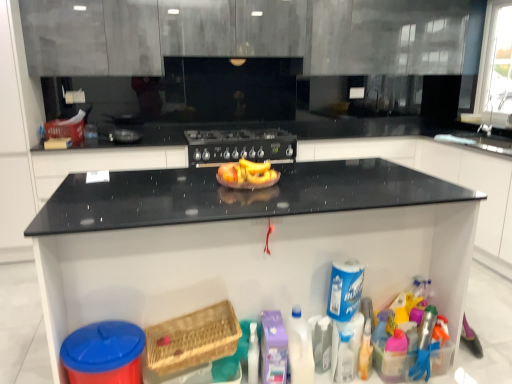
Question: Are translucent plastic toy at lower right and black granite countertop at center making contact?

Choices:
 (A) yes
 (B) no

Answer: (B)

Question: Is translucent plastic toy at lower right shorter than black granite countertop at center?

Choices:
 (A) yes
 (B) no

Answer: (A)

Question: Considering the relative sizes of translucent plastic toy at lower right and black granite countertop at center in the image provided, is translucent plastic toy at lower right taller than black granite countertop at center?

Choices:
 (A) no
 (B) yes

Answer: (A)

Question: Does translucent plastic toy at lower right appear on the right side of black granite countertop at center?

Choices:
 (A) yes
 (B) no

Answer: (A)

Question: Is translucent plastic toy at lower right bigger than black granite countertop at center?

Choices:
 (A) yes
 (B) no

Answer: (B)

Question: Relative to woven wood basket at lower center, is metallic silver toaster at center, which is the 2th appliance in right-to-left order, in front or behind?

Choices:
 (A) behind
 (B) front

Answer: (A)

Question: Considering the positions of metallic silver toaster at center, positioned as the first appliance in left-to-right order, and woven wood basket at lower center in the image, is metallic silver toaster at center, positioned as the first appliance in left-to-right order, taller or shorter than woven wood basket at lower center?

Choices:
 (A) tall
 (B) short

Answer: (B)

Question: From the image's perspective, is metallic silver toaster at center, which is the 2th appliance in right-to-left order, located above or below woven wood basket at lower center?

Choices:
 (A) above
 (B) below

Answer: (A)

Question: Is metallic silver toaster at center, positioned as the first appliance in left-to-right order, to the left or to the right of woven wood basket at lower center in the image?

Choices:
 (A) right
 (B) left

Answer: (B)

Question: In terms of size, does white plastic bottle at lower right appear bigger or smaller than matte gray cabinets at upper center, the 1th cabinetry from the left?

Choices:
 (A) big
 (B) small

Answer: (B)

Question: Is white plastic bottle at lower right inside or outside of matte gray cabinets at upper center, marked as the first cabinetry in a top-to-bottom arrangement?

Choices:
 (A) inside
 (B) outside

Answer: (B)

Question: Looking at their shapes, would you say white plastic bottle at lower right is wider or thinner than matte gray cabinets at upper center, marked as the first cabinetry in a top-to-bottom arrangement?

Choices:
 (A) thin
 (B) wide

Answer: (A)

Question: From the image's perspective, is white plastic bottle at lower right located above or below matte gray cabinets at upper center, which is counted as the 2th cabinetry, starting from the right?

Choices:
 (A) below
 (B) above

Answer: (A)

Question: Considering the positions of woven wood basket at lower center and metallic silver toaster at center, which is the 2th appliance in right-to-left order, in the image, is woven wood basket at lower center taller or shorter than metallic silver toaster at center, which is the 2th appliance in right-to-left order,?

Choices:
 (A) short
 (B) tall

Answer: (B)

Question: From the image's perspective, is woven wood basket at lower center above or below metallic silver toaster at center, positioned as the second appliance in bottom-to-top order?

Choices:
 (A) below
 (B) above

Answer: (A)